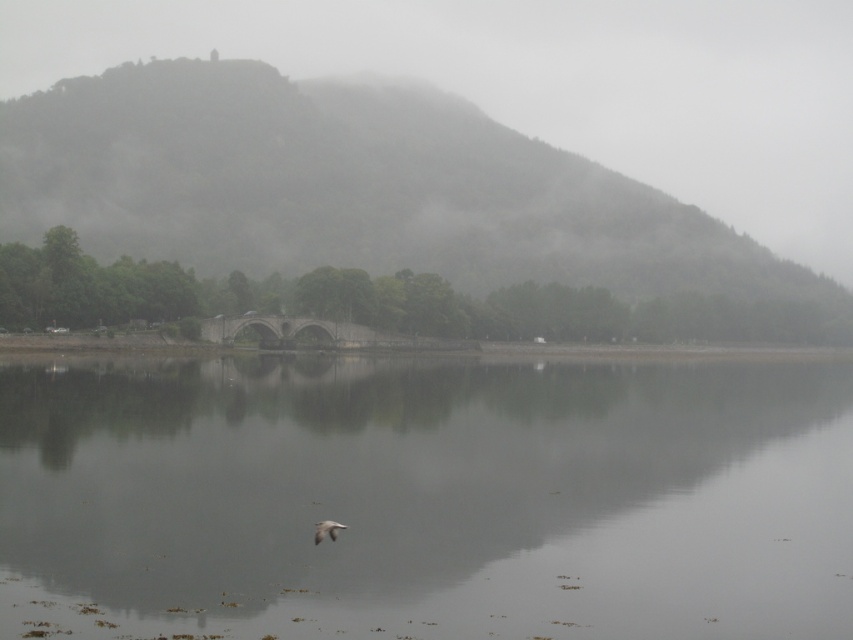
Question: Considering the relative positions of smooth gray water at center and white feathered bird at lower center in the image provided, where is smooth gray water at center located with respect to white feathered bird at lower center?

Choices:
 (A) right
 (B) left

Answer: (A)

Question: Is smooth gray water at center positioned before white feathered bird at lower center?

Choices:
 (A) yes
 (B) no

Answer: (A)

Question: Is foggy green hillside at upper center closer to the viewer compared to white feathered bird at lower center?

Choices:
 (A) yes
 (B) no

Answer: (B)

Question: Which point is closer to the camera?

Choices:
 (A) (131, 484)
 (B) (668, 284)

Answer: (A)

Question: Which object is positioned farthest from the smooth gray water at center?

Choices:
 (A) foggy green hillside at upper center
 (B) white feathered bird at lower center

Answer: (A)

Question: Which object is closer to the camera taking this photo?

Choices:
 (A) smooth gray water at center
 (B) white feathered bird at lower center
 (C) foggy green hillside at upper center

Answer: (A)